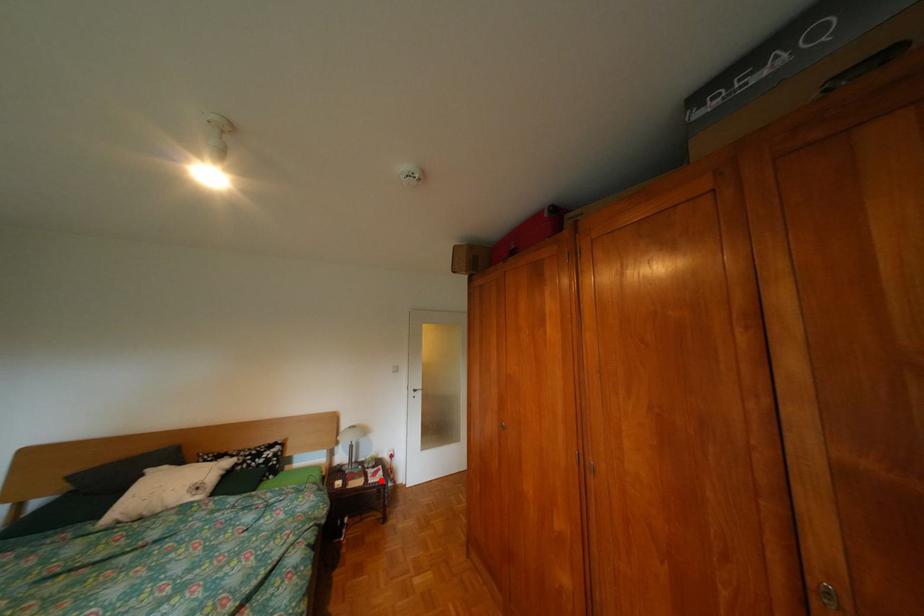
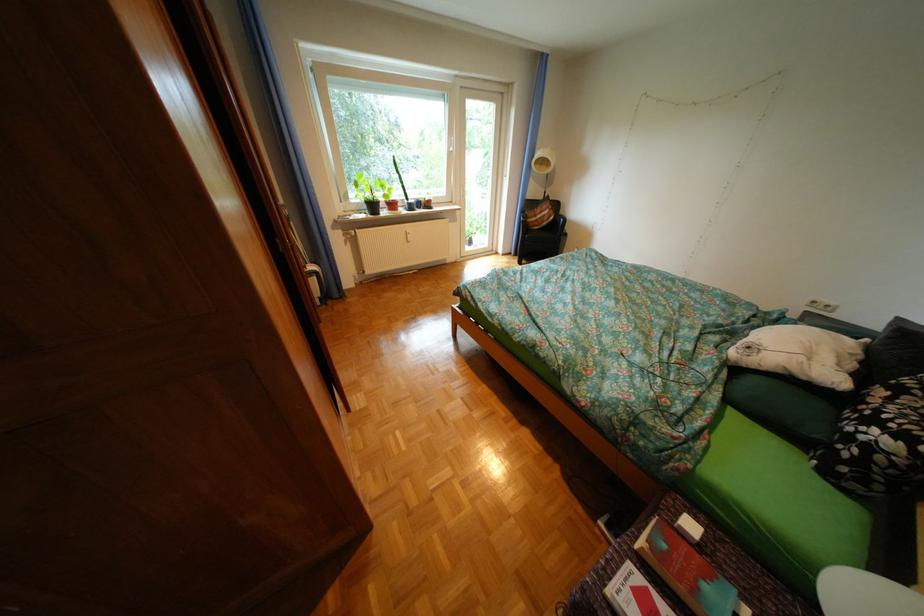
Find the pixel in the second image that matches the highlighted location in the first image.

(658, 565)